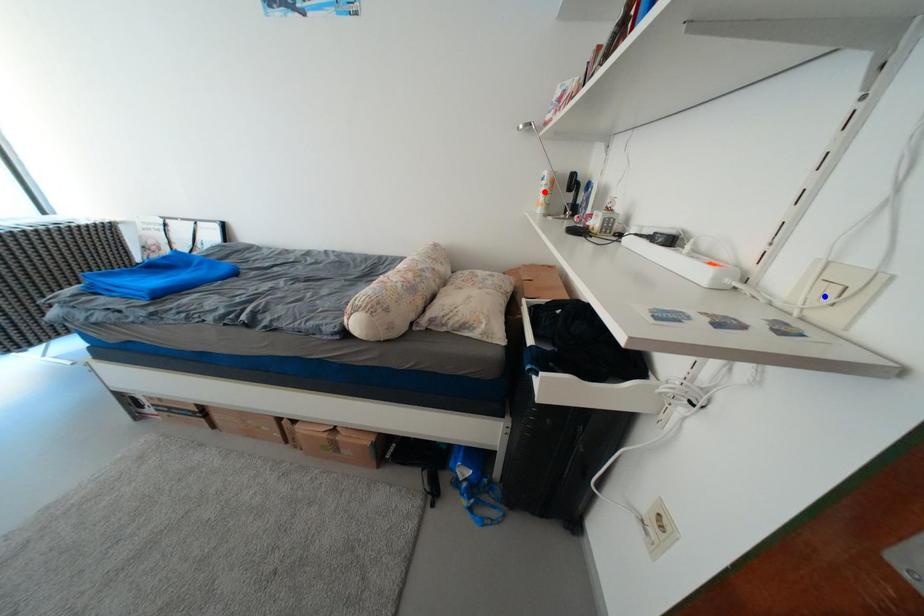
Question: In the image, two points are highlighted. Which point is nearer to the camera? Reply with the corresponding letter.

Choices:
 (A) blue point
 (B) red point

Answer: (A)